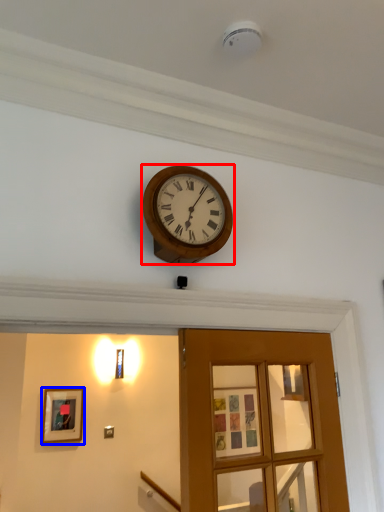
Question: Which object appears farthest to the camera in this image, wall clock (highlighted by a red box) or picture frame (highlighted by a blue box)?

Choices:
 (A) wall clock
 (B) picture frame

Answer: (B)